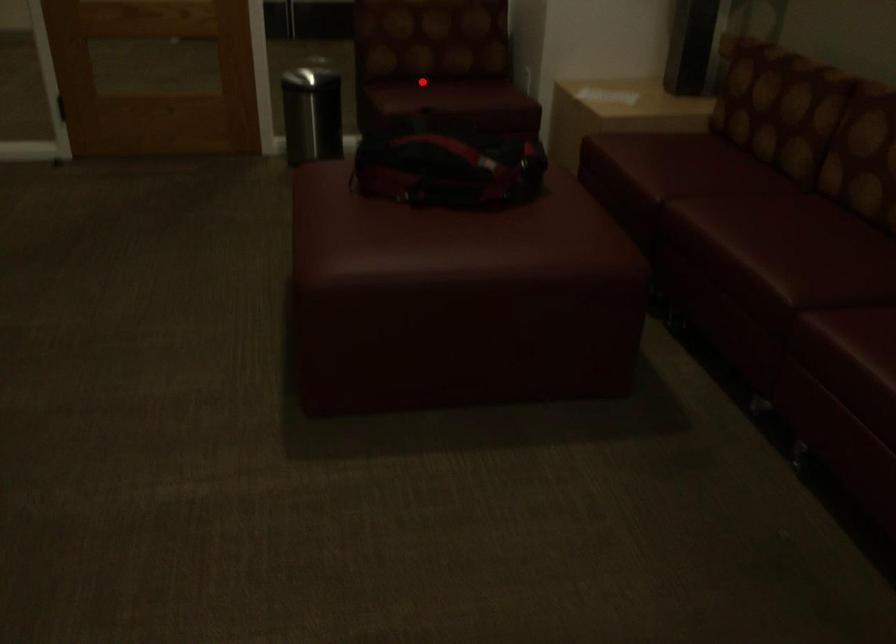
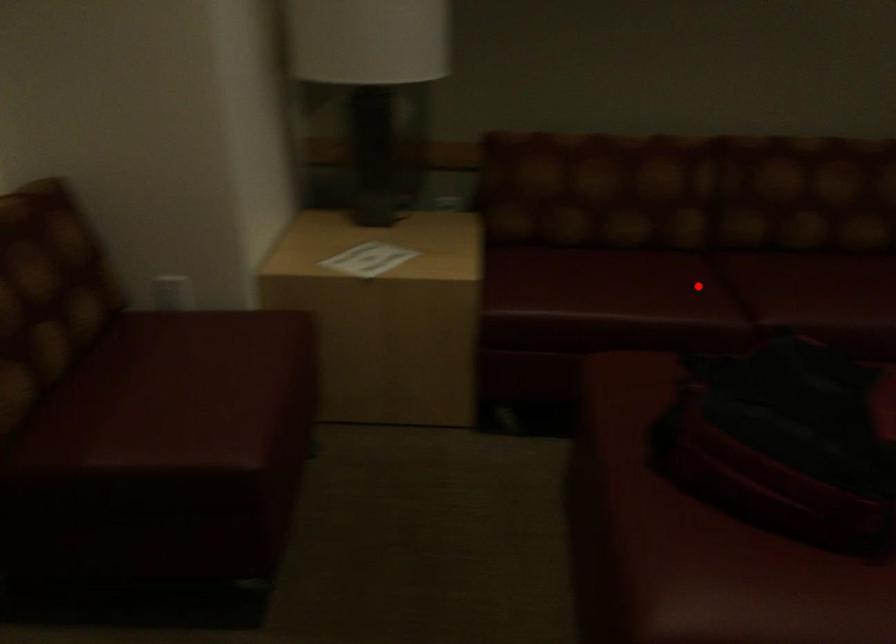
I am providing you with two images of the same scene from different viewpoints. A red point is marked on the first image and another point is marked on the second image. Are the points marked in image1 and image2 representing the same 3D position?

No